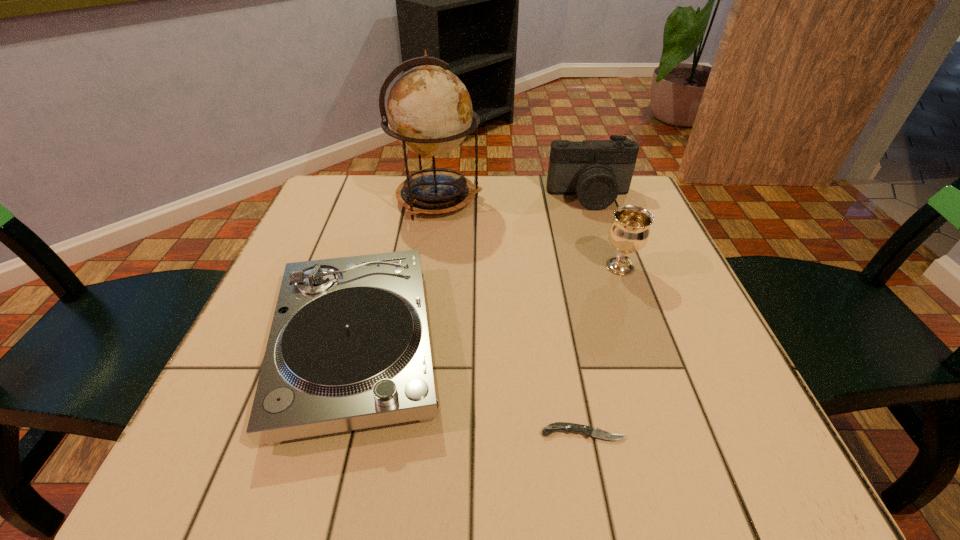
The width and height of the screenshot is (960, 540). In order to click on free space that satisfies the following two spatial constraints: 1. on the front side of the shortest object; 2. on the right side of the fourth tallest object in this screenshot , I will do `click(332, 433)`.

Identify the location of vacant space that satisfies the following two spatial constraints: 1. at the lens of the camera; 2. on the left side of the chalice. This screenshot has width=960, height=540. (613, 267).

At what (x,y) coordinates should I click in order to perform the action: click on blank space that satisfies the following two spatial constraints: 1. at the center of the tallest object; 2. on the left side of the chalice. Please return your answer as a coordinate pair (x, y). This screenshot has height=540, width=960. Looking at the image, I should click on (429, 267).

Find the location of a particular element. Image resolution: width=960 pixels, height=540 pixels. free space that satisfies the following two spatial constraints: 1. at the lens of the camera; 2. at the center of the tallest object is located at coordinates (590, 199).